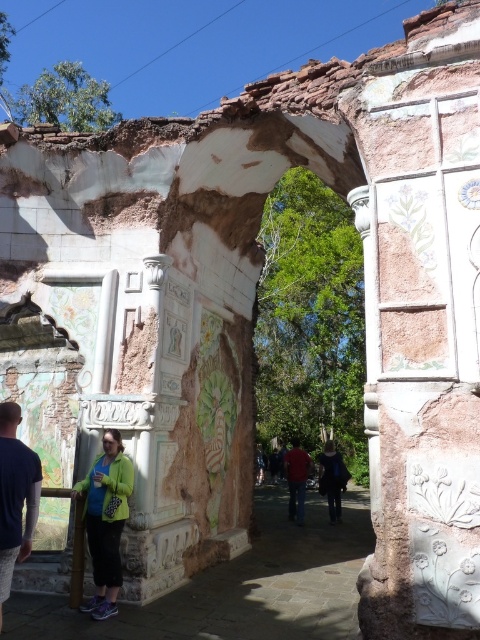
You are standing at the entrance of the archway and see both the dark blue textured shirt at center and the red matte shirt at center. Which shirt is farther away from you?

The dark blue textured shirt at center is 24.36 feet away from the red matte shirt at center, so the shirt that is farther away depends on your position. However, since both are at the center, they are equidistant from the entrance.

You are standing in front of the archway and want to place a dark blue textured shirt at center. Where exactly should you place it?

You should place the dark blue textured shirt at center at point (x=14, y=496).